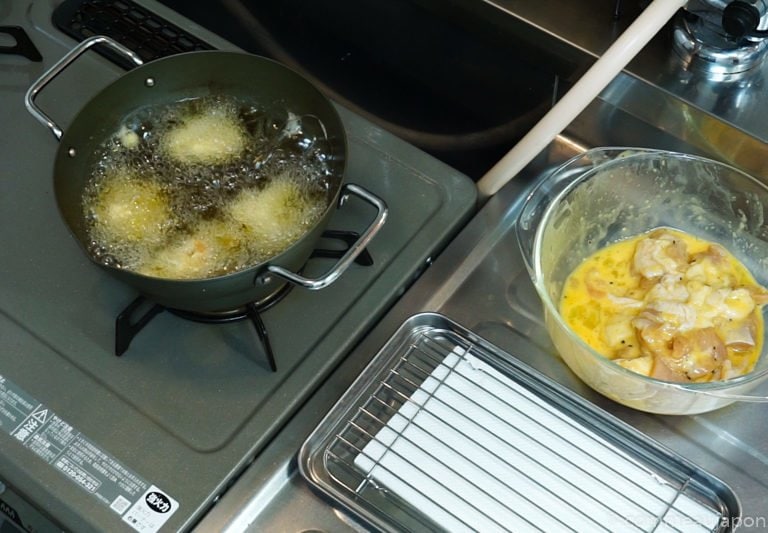
Where is `clear glass bowl`? clear glass bowl is located at coordinates (607, 221).